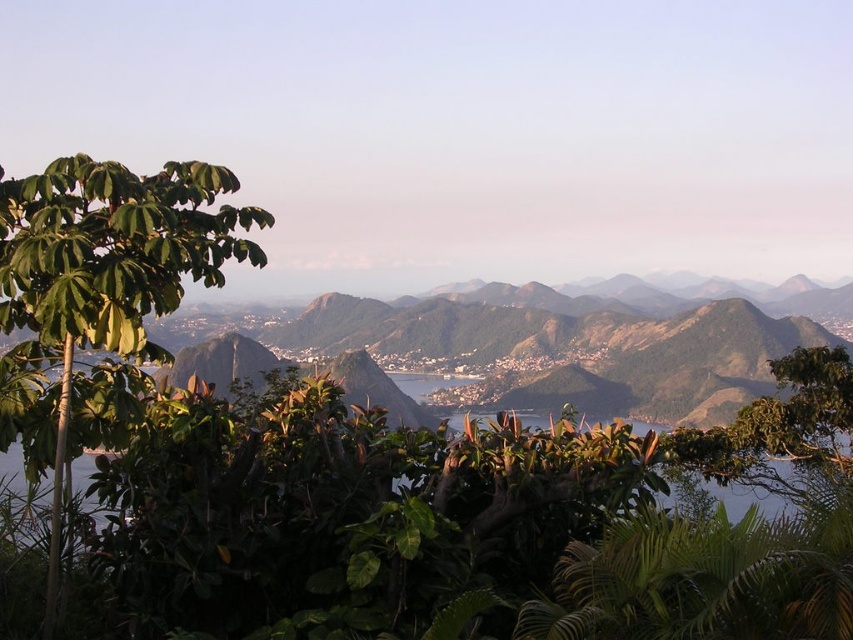
Question: Does green leafy tree at left appear under green leafy tree at center?

Choices:
 (A) yes
 (B) no

Answer: (B)

Question: Which point is closer to the camera?

Choices:
 (A) green leafy tree at center
 (B) green leafy tree at left

Answer: (B)

Question: Can you confirm if green leafy tree at left is positioned to the right of green leafy tree at center?

Choices:
 (A) no
 (B) yes

Answer: (A)

Question: Is green leafy tree at left positioned in front of green leafy tree at center?

Choices:
 (A) no
 (B) yes

Answer: (B)

Question: Which point is farther to the camera?

Choices:
 (A) green leafy tree at left
 (B) green leafy tree at center

Answer: (B)